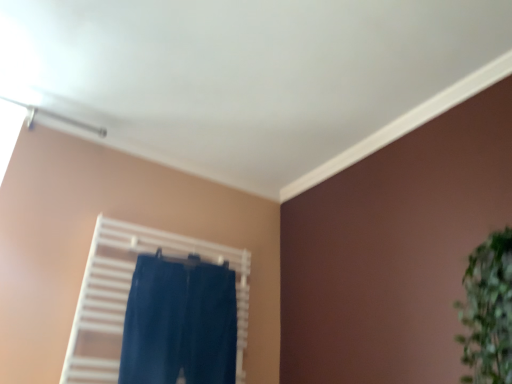
You are a GUI agent. You are given a task and a screenshot of the screen. Output one action in this format:
    pyautogui.click(x=<x>, y=<y>)
    Task: Click on the green leafy plant at right
    The width and height of the screenshot is (512, 384).
    Given the screenshot: What is the action you would take?
    pyautogui.click(x=488, y=311)

What do you see at coordinates (488, 311) in the screenshot? Image resolution: width=512 pixels, height=384 pixels. I see `green leafy plant at right` at bounding box center [488, 311].

I want to click on green leafy plant at right, so click(x=488, y=311).